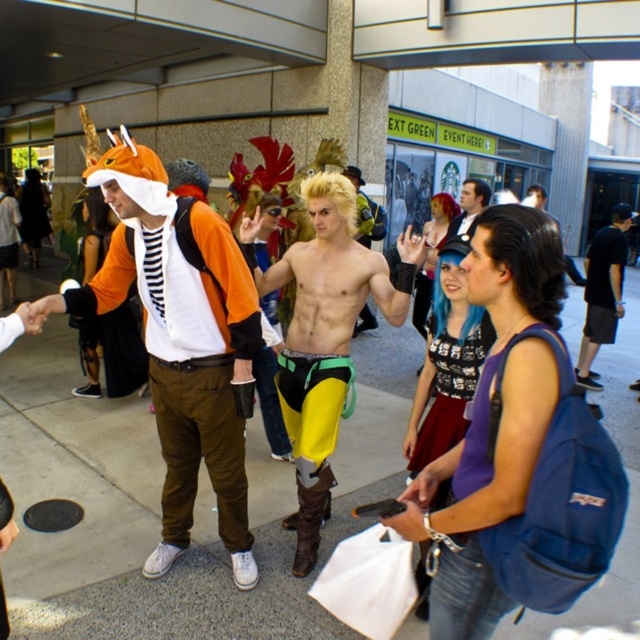
Does orange fabric fox costume at left have a greater height compared to black cotton t-shirt at center?

Correct, orange fabric fox costume at left is much taller as black cotton t-shirt at center.

Is orange fabric fox costume at left to the left of black cotton t-shirt at center from the viewer's perspective?

Indeed, orange fabric fox costume at left is positioned on the left side of black cotton t-shirt at center.

Which is behind, point (241, 468) or point (625, 218)?

The point (625, 218) is more distant.

At what (x,y) coordinates should I click in order to perform the action: click on orange fabric fox costume at left. Please return your answer as a coordinate pair (x, y). Looking at the image, I should click on (180, 340).

Looking at this image, can you confirm if shiny yellow pants at center is bigger than black cotton t-shirt at center?

Indeed, shiny yellow pants at center has a larger size compared to black cotton t-shirt at center.

Is shiny yellow pants at center positioned behind black cotton t-shirt at center?

No, shiny yellow pants at center is closer to the viewer.

Which is behind, point (307, 490) or point (609, 310)?

The point (609, 310) is more distant.

I want to click on shiny yellow pants at center, so click(324, 336).

Does shiny yellow pants at center have a lesser width compared to smooth black hair at center?

No.

Does point (332, 422) come closer to viewer compared to point (445, 232)?

Yes.

Between point (280, 268) and point (470, 200), which one is positioned in front?

Positioned in front is point (280, 268).

Where is `shiny yellow pants at center`? This screenshot has width=640, height=640. shiny yellow pants at center is located at coordinates (324, 336).